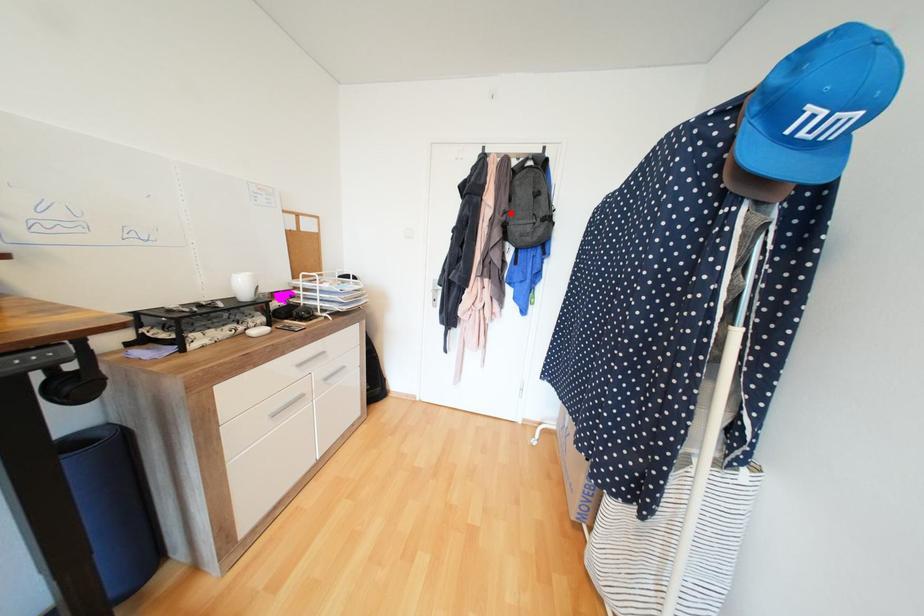
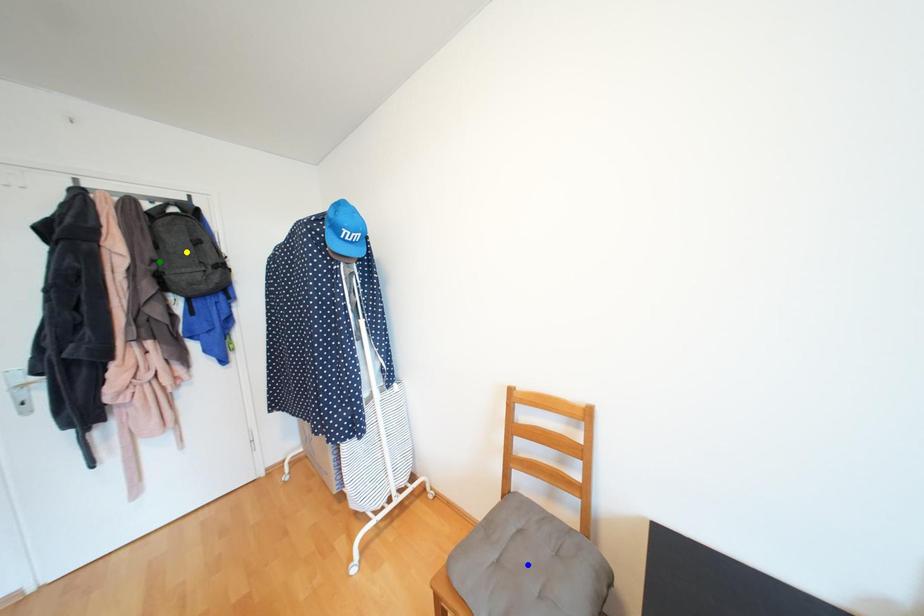
Question: I am providing you with two images of the same scene from different viewpoints. A red point is marked on the first image. You are given multiple points on the second image. Which point in image 2 represents the same 3d spot as the red point in image 1?

Choices:
 (A) green point
 (B) yellow point
 (C) blue point

Answer: (A)